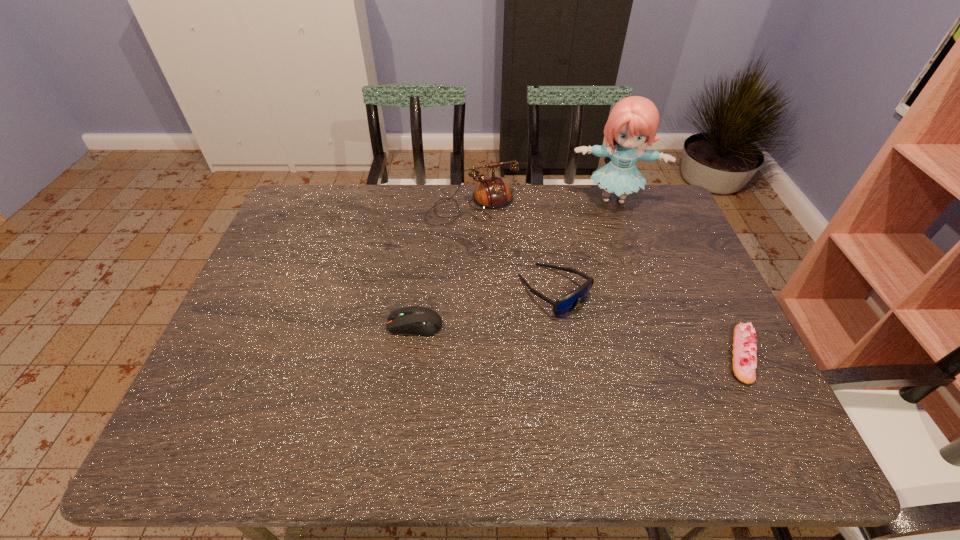
At what (x,y) coordinates should I click in order to perform the action: click on free space between the sunglasses and the telephone. Please return your answer as a coordinate pair (x, y). The width and height of the screenshot is (960, 540). Looking at the image, I should click on (514, 248).

Identify which object is the nearest to the computer equipment. Please provide its 2D coordinates. Your answer should be formatted as a tuple, i.e. [(x, y)], where the tuple contains the x and y coordinates of a point satisfying the conditions above.

[(565, 304)]

Select which object appears as the closest to the computer equipment. Please provide its 2D coordinates. Your answer should be formatted as a tuple, i.e. [(x, y)], where the tuple contains the x and y coordinates of a point satisfying the conditions above.

[(565, 304)]

You are a GUI agent. You are given a task and a screenshot of the screen. Output one action in this format:
    pyautogui.click(x=<x>, y=<y>)
    Task: Click on the vacant space that satisfies the following two spatial constraints: 1. on the front side of the telephone; 2. on the right side of the third tallest object
    
    Given the screenshot: What is the action you would take?
    pyautogui.click(x=471, y=290)